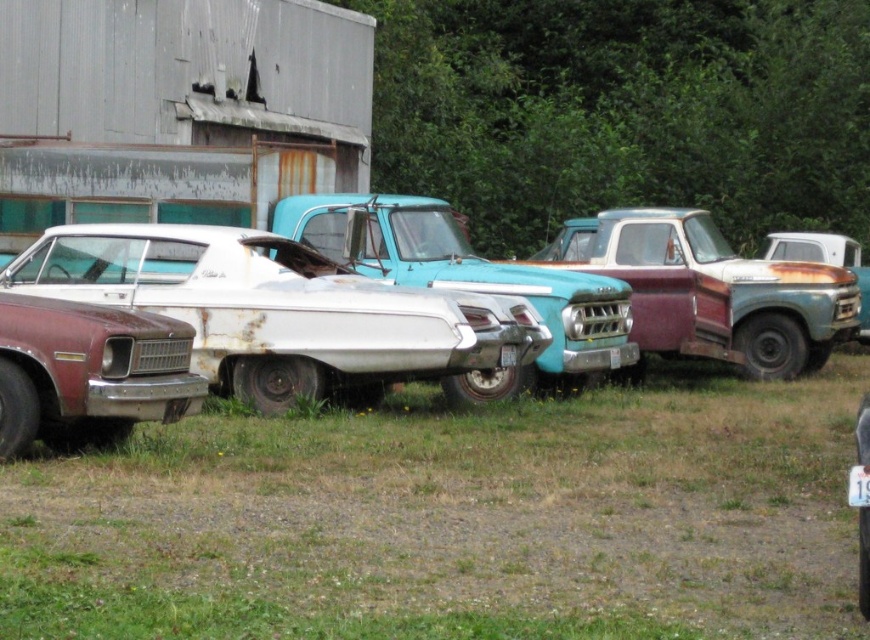
Who is taller, rusty metal pickup truck at center or rusty metallic sedan at lower left?

rusty metal pickup truck at center is taller.

Who is positioned more to the right, rusty metal pickup truck at center or rusty metallic sedan at lower left?

rusty metal pickup truck at center is more to the right.

Is point (663, 320) closer to camera compared to point (132, 333)?

No, (663, 320) is behind (132, 333).

At what (x,y) coordinates should I click in order to perform the action: click on rusty metal pickup truck at center. Please return your answer as a coordinate pair (x, y). This screenshot has width=870, height=640. Looking at the image, I should click on (718, 292).

Is green grass at lower center below white matte pickup truck at center?

Yes.

Is green grass at lower center closer to the viewer compared to white matte pickup truck at center?

That is True.

Image resolution: width=870 pixels, height=640 pixels. I want to click on green grass at lower center, so click(454, 518).

What do you see at coordinates (278, 307) in the screenshot?
I see `rusty matte white car at center` at bounding box center [278, 307].

At what (x,y) coordinates should I click in order to perform the action: click on rusty matte white car at center. Please return your answer as a coordinate pair (x, y). The image size is (870, 640). Looking at the image, I should click on (278, 307).

You are a GUI agent. You are given a task and a screenshot of the screen. Output one action in this format:
    pyautogui.click(x=<x>, y=<y>)
    Task: Click on the rusty matte white car at center
    This screenshot has width=870, height=640.
    Given the screenshot: What is the action you would take?
    pyautogui.click(x=278, y=307)

At what (x,y) coordinates should I click in order to perform the action: click on rusty matte white car at center. Please return your answer as a coordinate pair (x, y). Looking at the image, I should click on (278, 307).